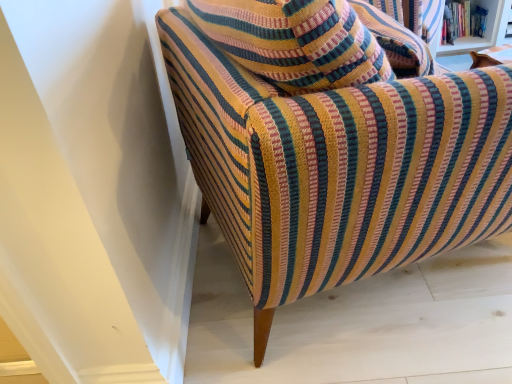
Question: Is hardcover book at upper right to the left of textured striped armchair at center from the viewer's perspective?

Choices:
 (A) yes
 (B) no

Answer: (B)

Question: From a real-world perspective, is hardcover book at upper right positioned over textured striped armchair at center based on gravity?

Choices:
 (A) no
 (B) yes

Answer: (A)

Question: Is hardcover book at upper right shorter than textured striped armchair at center?

Choices:
 (A) yes
 (B) no

Answer: (A)

Question: Are hardcover book at upper right and textured striped armchair at center located far from each other?

Choices:
 (A) yes
 (B) no

Answer: (A)

Question: From the image's perspective, is hardcover book at upper right above textured striped armchair at center?

Choices:
 (A) yes
 (B) no

Answer: (A)

Question: Considering the relative sizes of hardcover book at upper right and textured striped armchair at center in the image provided, is hardcover book at upper right taller than textured striped armchair at center?

Choices:
 (A) yes
 (B) no

Answer: (B)

Question: Is textured striped armchair at center looking in the opposite direction of hardcover book at upper right?

Choices:
 (A) no
 (B) yes

Answer: (A)

Question: Is textured striped armchair at center bigger than hardcover book at upper right?

Choices:
 (A) yes
 (B) no

Answer: (A)

Question: From the image's perspective, does textured striped armchair at center appear lower than hardcover book at upper right?

Choices:
 (A) yes
 (B) no

Answer: (A)

Question: From a real-world perspective, is textured striped armchair at center positioned under hardcover book at upper right based on gravity?

Choices:
 (A) yes
 (B) no

Answer: (B)

Question: Is textured striped armchair at center located outside hardcover book at upper right?

Choices:
 (A) no
 (B) yes

Answer: (B)

Question: Is hardcover book at upper right completely or partially inside textured striped armchair at center?

Choices:
 (A) no
 (B) yes

Answer: (A)

Question: From a real-world perspective, is textured striped armchair at center above or below hardcover book at upper right?

Choices:
 (A) above
 (B) below

Answer: (A)